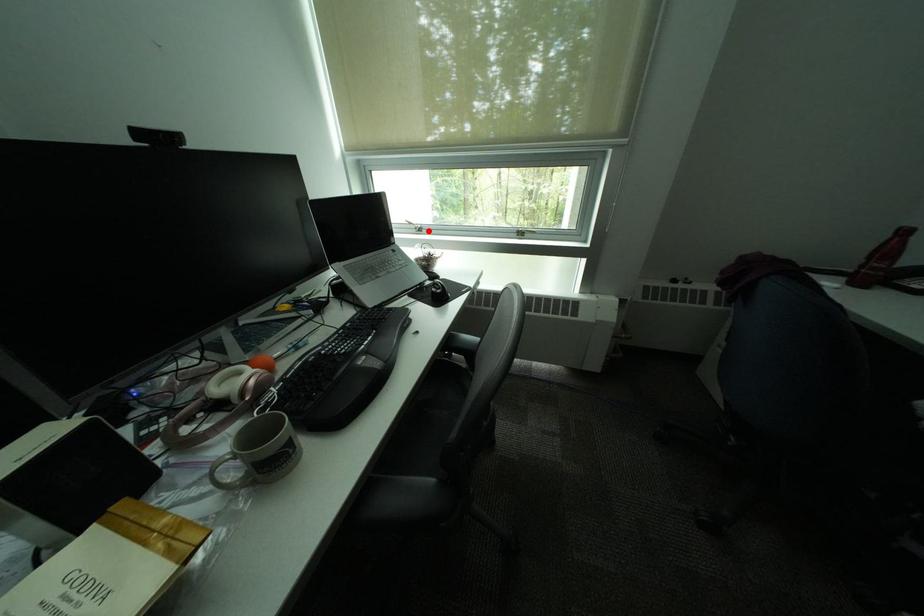
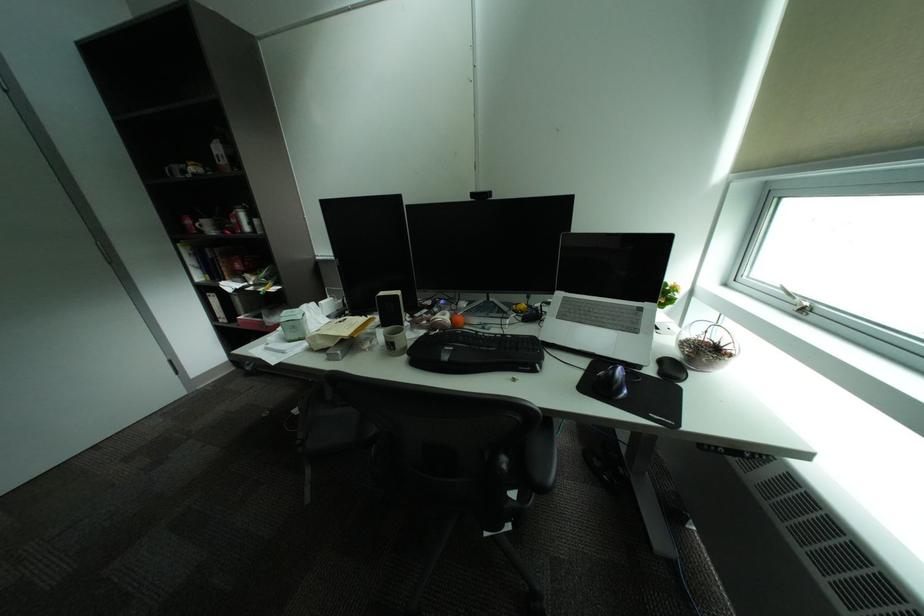
Question: I am providing you with two images of the same scene from different viewpoints. In image1, a red point is highlighted. Considering the same 3D point in image2, which of the following is correct?

Choices:
 (A) It is closer
 (B) It is farther

Answer: (B)